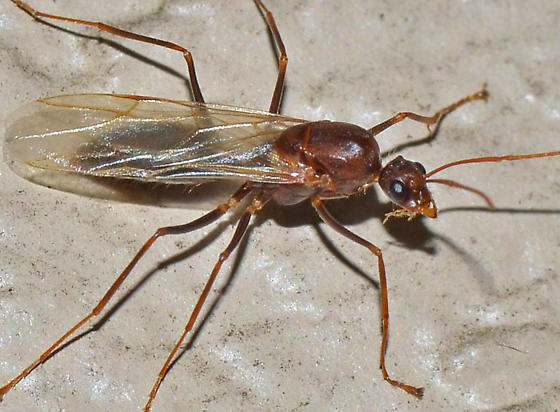
Find the location of a particular element. surface is located at coordinates (379, 43).